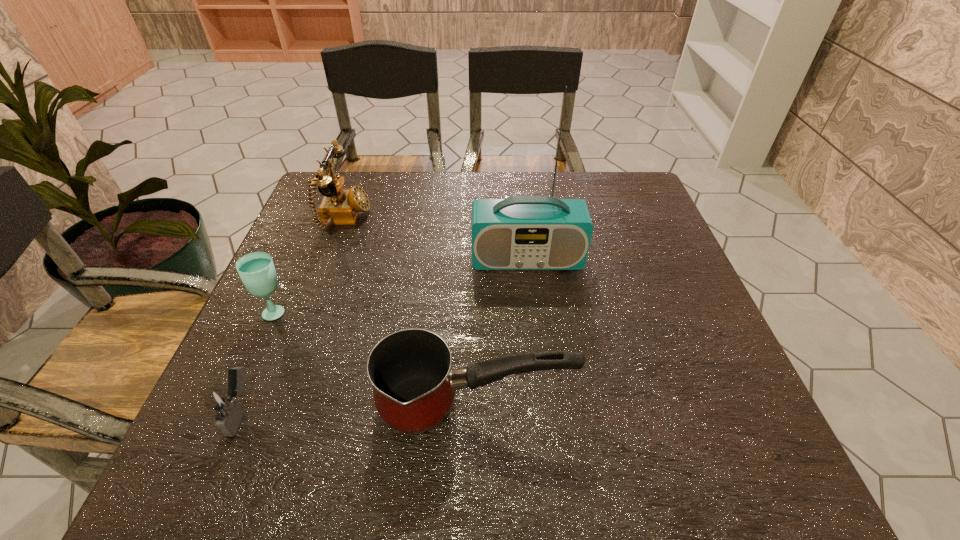
Find the location of a particular element. The height and width of the screenshot is (540, 960). object that is at the far edge is located at coordinates (339, 206).

This screenshot has width=960, height=540. I want to click on saucepan at the near edge, so click(414, 386).

At what (x,y) coordinates should I click in order to perform the action: click on igniter at the near edge. Please return your answer as a coordinate pair (x, y). This screenshot has width=960, height=540. Looking at the image, I should click on (222, 405).

Find the location of a particular element. The image size is (960, 540). telephone that is at the left edge is located at coordinates (339, 206).

This screenshot has height=540, width=960. Identify the location of glass at the left edge. (256, 270).

At what (x,y) coordinates should I click in order to perform the action: click on igniter that is at the left edge. Please return your answer as a coordinate pair (x, y). The width and height of the screenshot is (960, 540). Looking at the image, I should click on (222, 405).

Locate an element on the screen. object located in the far left corner section of the desktop is located at coordinates (339, 206).

Find the location of a particular element. The width and height of the screenshot is (960, 540). object that is at the near left corner is located at coordinates (222, 405).

In the image, there is a desktop. Where is `vacant region at the far edge`? vacant region at the far edge is located at coordinates (565, 191).

Image resolution: width=960 pixels, height=540 pixels. What are the coordinates of `vacant point at the near edge` in the screenshot? It's located at tap(526, 483).